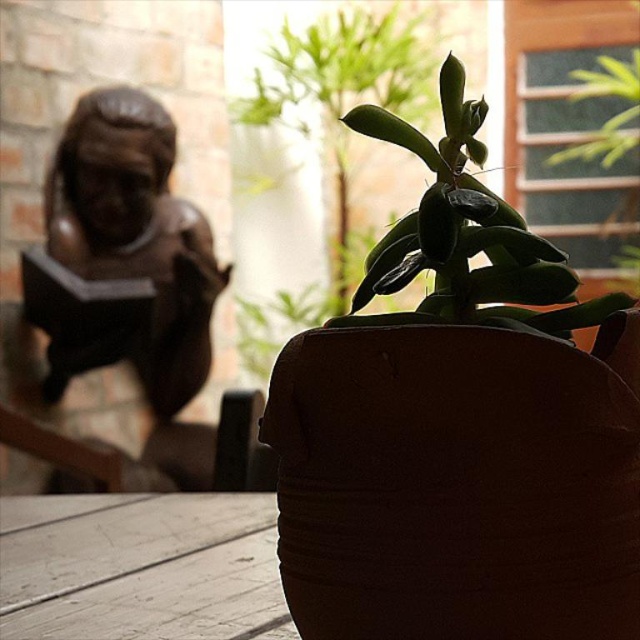
Consider the image. Between bronze statue at left and green matte succulent at center, which one is positioned lower?

green matte succulent at center is lower down.

Between point (90, 248) and point (518, 241), which one is positioned in front?

Point (518, 241) is in front.

I want to click on bronze statue at left, so click(x=136, y=234).

Is white wood table at lower left bigger than green matte succulent at center?

Correct, white wood table at lower left is larger in size than green matte succulent at center.

Identify the location of white wood table at lower left. This screenshot has width=640, height=640. (140, 566).

This screenshot has width=640, height=640. What are the coordinates of `white wood table at lower left` in the screenshot? It's located at (140, 566).

Find the location of `white wood table at lower left`. white wood table at lower left is located at coordinates (140, 566).

Measure the distance between point (115, 513) and camera.

Point (115, 513) and camera are 1.43 meters apart from each other.

Does point (256, 515) lie behind point (140, 250)?

No, (256, 515) is closer to viewer.

Which is behind, point (16, 532) or point (145, 333)?

Positioned behind is point (145, 333).

Where is `white wood table at lower left`? white wood table at lower left is located at coordinates (140, 566).